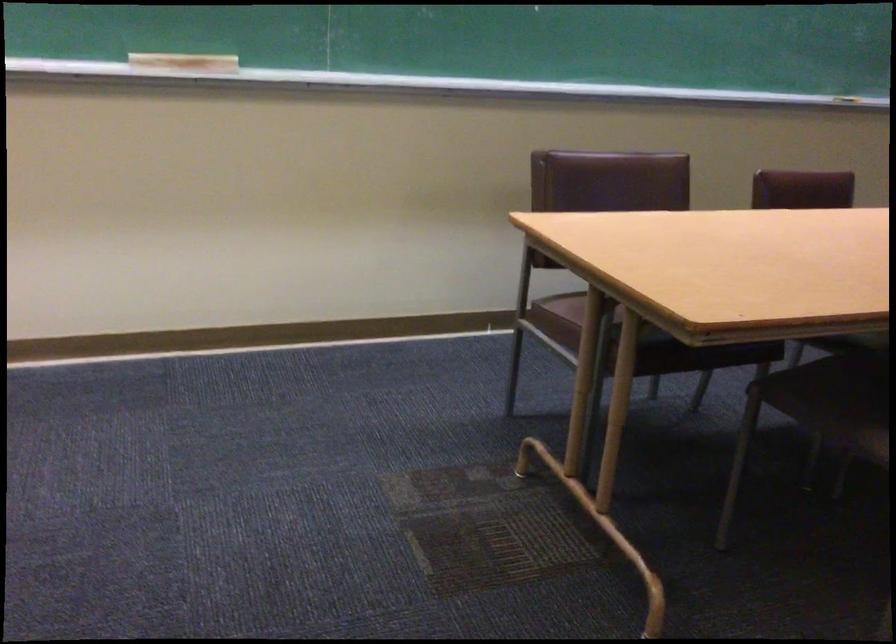
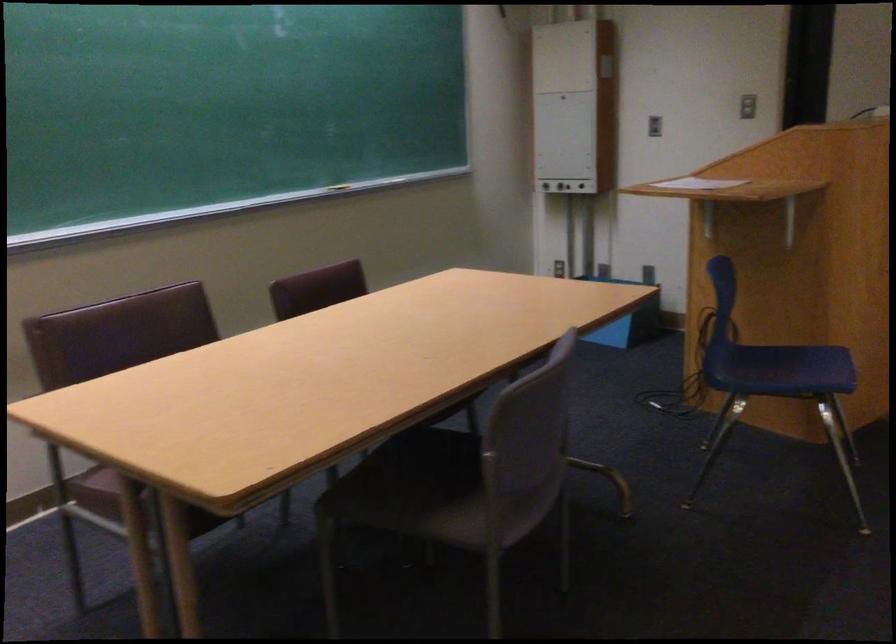
In the second image, find the point that corresponds to [540,312] in the first image.

(96, 491)